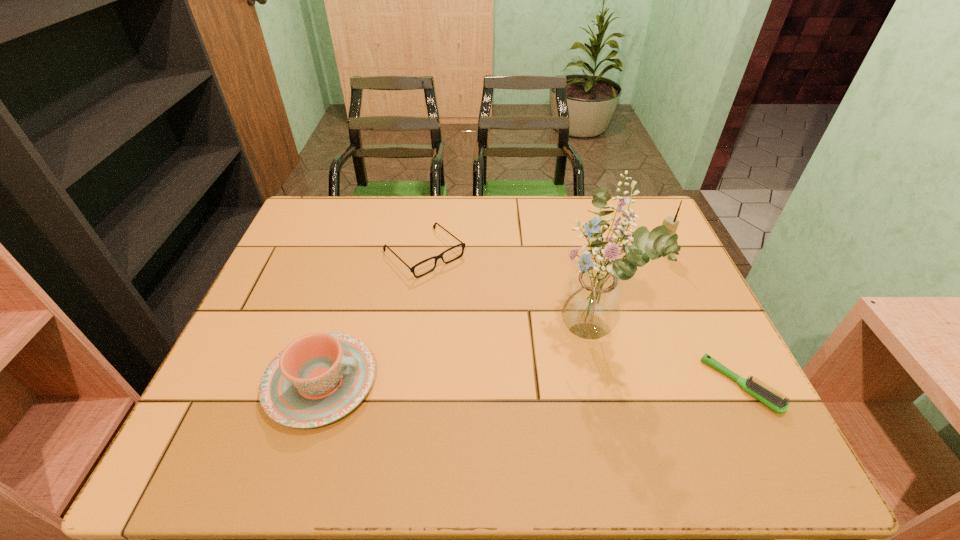
Locate an element on the screen. This screenshot has width=960, height=540. vacant space at the far right corner of the desktop is located at coordinates (643, 213).

In the image, there is a desktop. Where is `blank space at the near right corner`? This screenshot has width=960, height=540. blank space at the near right corner is located at coordinates click(710, 420).

Find the location of a particular element. empty space that is in between the fourth tallest object and the cellular telephone is located at coordinates (542, 252).

The height and width of the screenshot is (540, 960). Identify the location of vacant space that is in between the tallest object and the chinaware. (455, 356).

This screenshot has width=960, height=540. I want to click on free point between the cellular telephone and the chinaware, so click(x=491, y=316).

Where is `blank region between the shortest object and the fourth shortest object`? The width and height of the screenshot is (960, 540). blank region between the shortest object and the fourth shortest object is located at coordinates (701, 318).

This screenshot has height=540, width=960. What are the coordinates of `free area in between the fourth tallest object and the bouquet` in the screenshot? It's located at (507, 292).

Locate an element on the screen. The image size is (960, 540). vacant area between the tallest object and the shortest object is located at coordinates (665, 359).

The width and height of the screenshot is (960, 540). Find the location of `empty location between the tallest object and the chinaware`. empty location between the tallest object and the chinaware is located at coordinates (455, 356).

Find the location of `vacant point located between the spectacles and the bouquet`. vacant point located between the spectacles and the bouquet is located at coordinates (507, 292).